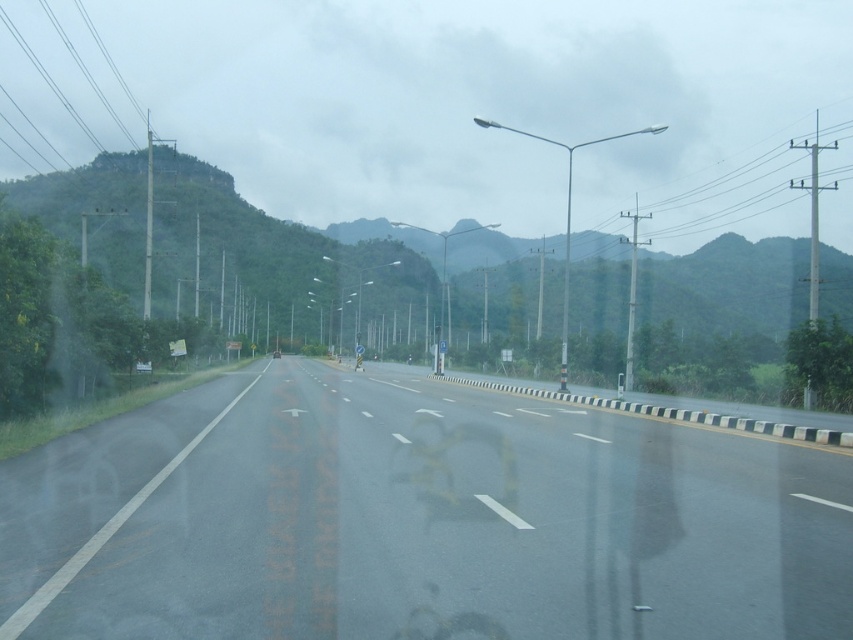
Question: Is asphalt road at center below green textured mountain at left?

Choices:
 (A) no
 (B) yes

Answer: (B)

Question: Is asphalt road at center bigger than green textured mountain at left?

Choices:
 (A) yes
 (B) no

Answer: (B)

Question: Where is asphalt road at center located in relation to green textured mountain at left in the image?

Choices:
 (A) right
 (B) left

Answer: (B)

Question: Which point is closer to the camera taking this photo?

Choices:
 (A) (265, 227)
 (B) (722, 525)

Answer: (B)